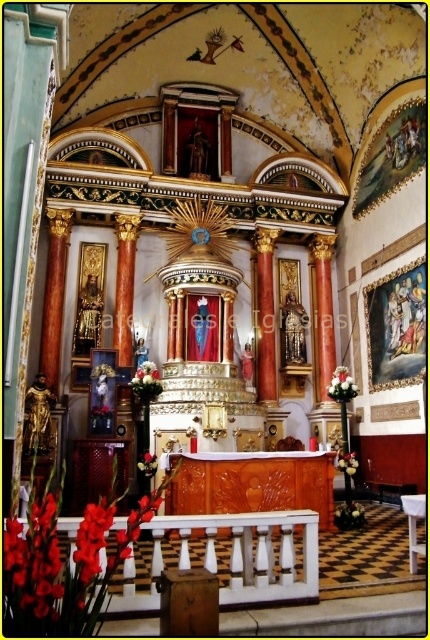
You are an interior designer planning to place a decorative item between the shiny red petals at lower left and the white matte flower at lower center. Which object should you choose if you want the item to be wider than both existing objects?

The white matte flower at lower center is wider than the shiny red petals at lower left. Therefore, the decorative item should be wider than the white matte flower at lower center to satisfy the requirement.